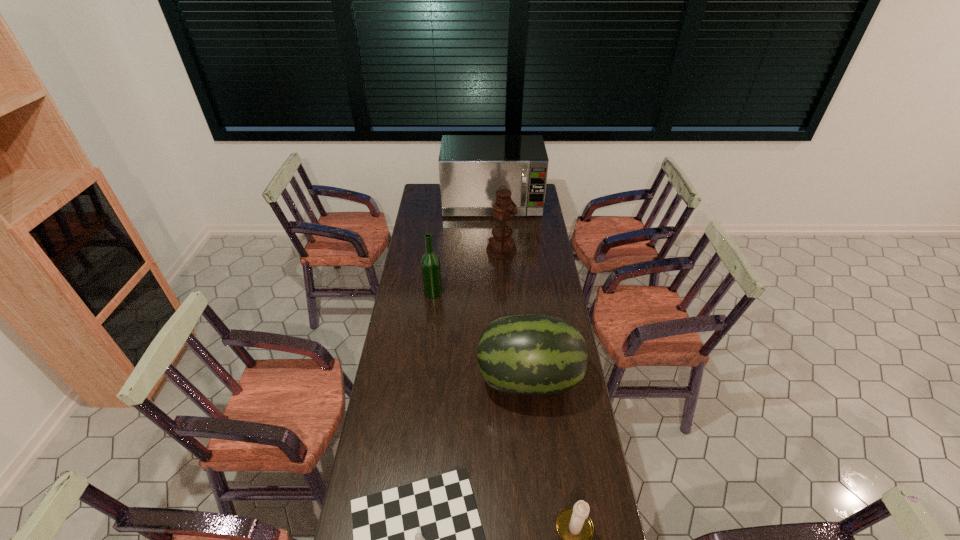
I want to click on the fourth closest object to the oil lamp, so click(424, 539).

At what (x,y) coordinates should I click in order to perform the action: click on vacant space that satisfies the following two spatial constraints: 1. with the door open on the watermelon; 2. on the right side of the microwave oven. Please return your answer as a coordinate pair (x, y). This screenshot has height=540, width=960. Looking at the image, I should click on (499, 379).

At what (x,y) coordinates should I click in order to perform the action: click on free location that satisfies the following two spatial constraints: 1. with the door open on the farthest object; 2. on the left side of the fourth farthest object. Please return your answer as a coordinate pair (x, y). This screenshot has width=960, height=540. Looking at the image, I should click on (499, 379).